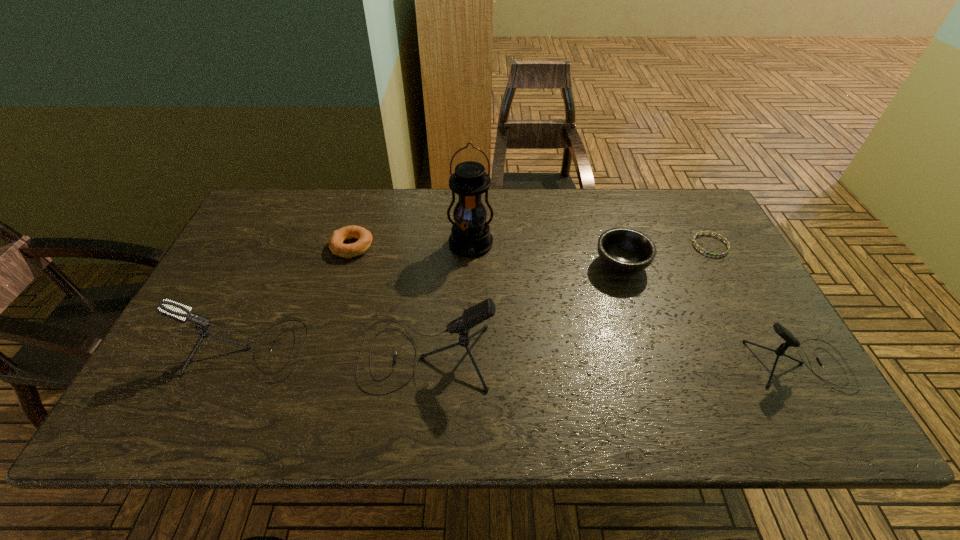
Where is `vacant space that satisfies the following two spatial constraints: 1. above the tallest object, indicating its light source; 2. on the stand of the leftmost microphone`? The width and height of the screenshot is (960, 540). vacant space that satisfies the following two spatial constraints: 1. above the tallest object, indicating its light source; 2. on the stand of the leftmost microphone is located at coordinates (468, 350).

Image resolution: width=960 pixels, height=540 pixels. I want to click on vacant area that satisfies the following two spatial constraints: 1. on the surface of the shortest object showing star-shaped elements; 2. on the stand of the second microphone from left to right, so click(769, 355).